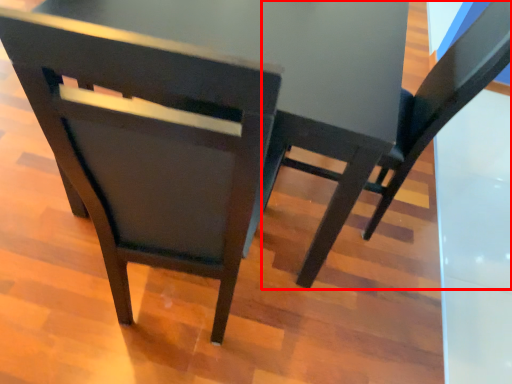
Question: From the image, what is the correct spatial relationship of chair (annotated by the red box) in relation to chair?

Choices:
 (A) left
 (B) right

Answer: (B)